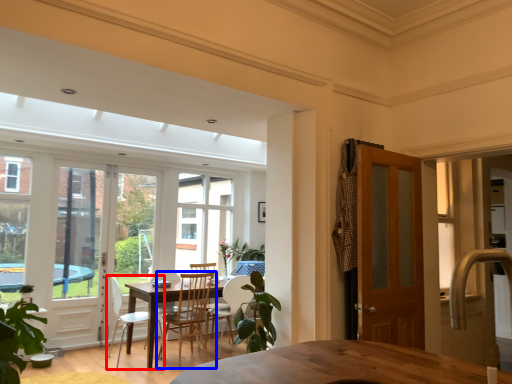
Question: Which point is further to the camera, chair (highlighted by a red box) or chair (highlighted by a blue box)?

Choices:
 (A) chair
 (B) chair

Answer: (B)